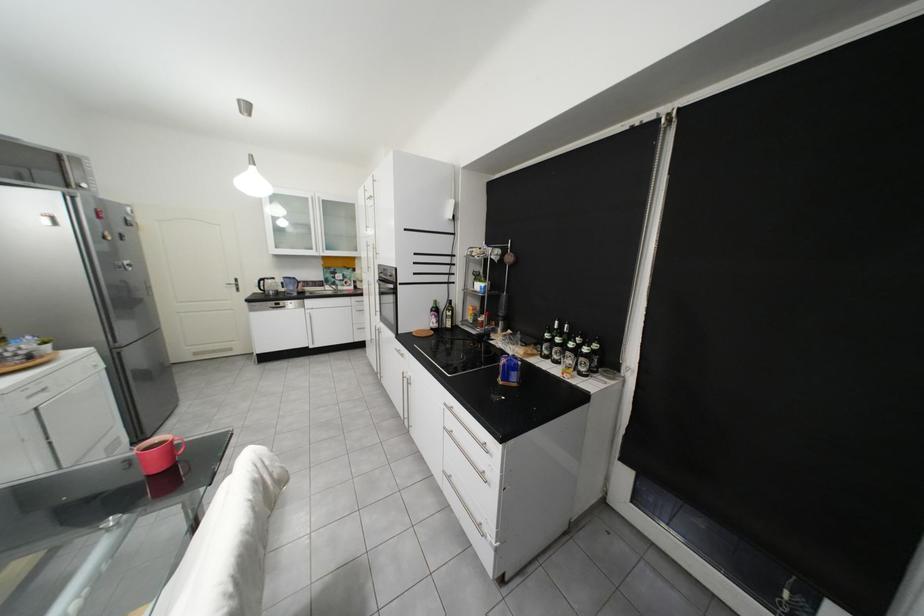
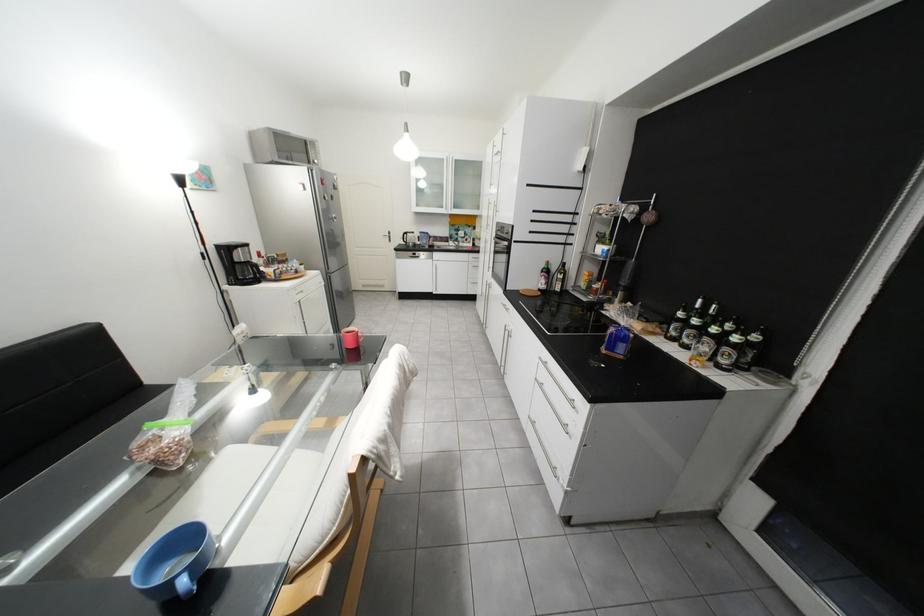
Question: The camera is either moving clockwise (left) or counter-clockwise (right) around the object. The first image is from the beginning of the video and the second image is from the end. Is the camera moving left or right when shooting the video?

Choices:
 (A) Left
 (B) Right

Answer: (B)